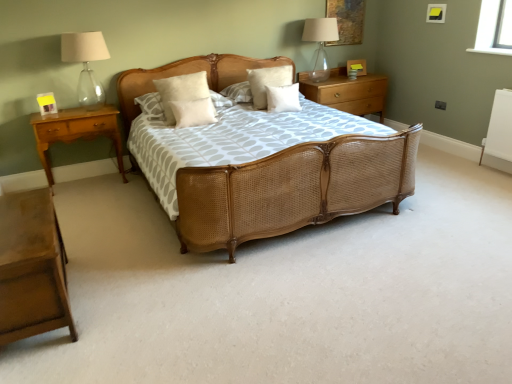
Question: From a real-world perspective, is white soft pillow at center, the fourth pillow positioned from the right, physically below light brown wood nightstand at left, which ranks as the 2th nightstand in bottom-to-top order?

Choices:
 (A) yes
 (B) no

Answer: (B)

Question: Is white soft pillow at center, the fourth pillow positioned from the right, at the right side of light brown wood nightstand at left, placed as the second nightstand when sorted from top to bottom?

Choices:
 (A) yes
 (B) no

Answer: (A)

Question: Considering the relative sizes of white soft pillow at center, the fourth pillow positioned from the right, and light brown wood nightstand at left, placed as the second nightstand when sorted from top to bottom, in the image provided, is white soft pillow at center, the fourth pillow positioned from the right, smaller than light brown wood nightstand at left, placed as the second nightstand when sorted from top to bottom,?

Choices:
 (A) no
 (B) yes

Answer: (B)

Question: Is light brown wood nightstand at left, which appears as the 2th nightstand when viewed from the back, completely or partially inside white soft pillow at center, placed as the 1th pillow when sorted from left to right?

Choices:
 (A) no
 (B) yes

Answer: (A)

Question: Does white soft pillow at center, placed as the 1th pillow when sorted from left to right, have a lesser height compared to light brown wood nightstand at left, which is the 2th nightstand from front to back?

Choices:
 (A) no
 (B) yes

Answer: (B)

Question: Considering the positions of light brown wood nightstand at lower left, placed as the third nightstand when sorted from top to bottom, and white soft pillow at center, the fourth pillow positioned from the right, in the image, is light brown wood nightstand at lower left, placed as the third nightstand when sorted from top to bottom, bigger or smaller than white soft pillow at center, the fourth pillow positioned from the right,?

Choices:
 (A) small
 (B) big

Answer: (B)

Question: From a real-world perspective, relative to white soft pillow at center, placed as the 1th pillow when sorted from left to right, is light brown wood nightstand at lower left, which is the first nightstand from bottom to top, vertically above or below?

Choices:
 (A) below
 (B) above

Answer: (A)

Question: In the image, is light brown wood nightstand at lower left, which is the first nightstand from bottom to top, on the left side or the right side of white soft pillow at center, the fourth pillow positioned from the right?

Choices:
 (A) left
 (B) right

Answer: (A)

Question: From the image's perspective, is light brown wood nightstand at lower left, acting as the second nightstand starting from the right, located above or below white soft pillow at center, the fourth pillow positioned from the right?

Choices:
 (A) above
 (B) below

Answer: (B)

Question: In the image, is white soft pillow at center, the second pillow when ordered from left to right, positioned in front of or behind white soft pillow at center, placed as the 1th pillow when sorted from left to right?

Choices:
 (A) front
 (B) behind

Answer: (A)

Question: Choose the correct answer: Is white soft pillow at center, the second pillow when ordered from left to right, inside white soft pillow at center, placed as the 1th pillow when sorted from left to right, or outside it?

Choices:
 (A) outside
 (B) inside

Answer: (A)

Question: Is point (198, 114) positioned closer to the camera than point (181, 122)?

Choices:
 (A) farther
 (B) closer

Answer: (A)

Question: From a real-world perspective, relative to white soft pillow at center, the fourth pillow positioned from the right, is white soft pillow at center, the second pillow when ordered from left to right, vertically above or below?

Choices:
 (A) above
 (B) below

Answer: (B)

Question: In the image, is light brown wood nightstand at left, the third nightstand from the right, positioned in front of or behind white matte pillow at center, which is the first pillow from right to left?

Choices:
 (A) behind
 (B) front

Answer: (B)

Question: Considering the positions of light brown wood nightstand at left, placed as the second nightstand when sorted from top to bottom, and white matte pillow at center, acting as the fourth pillow starting from the left, in the image, is light brown wood nightstand at left, placed as the second nightstand when sorted from top to bottom, bigger or smaller than white matte pillow at center, acting as the fourth pillow starting from the left,?

Choices:
 (A) big
 (B) small

Answer: (A)